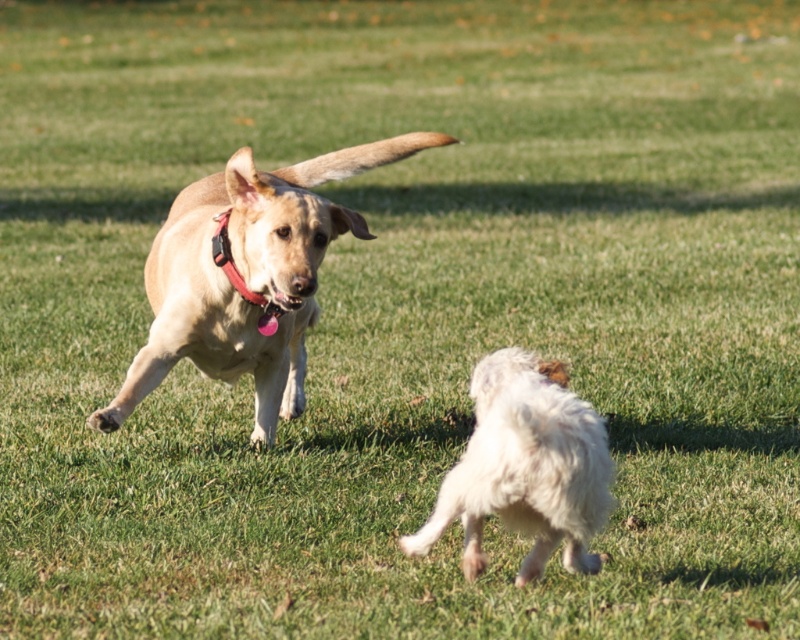
You are a dog trainer observing two dogs in a grassy field. You notice the light brown fur dog at center and the red leather collar at upper center. Which object is wider?

The light brown fur dog at center is wider than the red leather collar at upper center.

Based on the photo, you are standing at the point with coordinates point (222, 220) and want to walk towards the point (521, 353). According to the scene, will you have to walk through any obstacles?

The point (521, 353) is in front of point (222, 220), so there are no obstacles in between. You can walk directly towards the point (521, 353) without any obstruction.